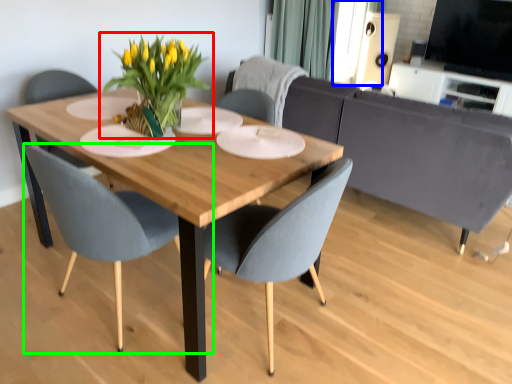
Question: Which object is positioned closest to houseplant (highlighted by a red box)? Select from window screen (highlighted by a blue box) and chair (highlighted by a green box).

Choices:
 (A) window screen
 (B) chair

Answer: (B)